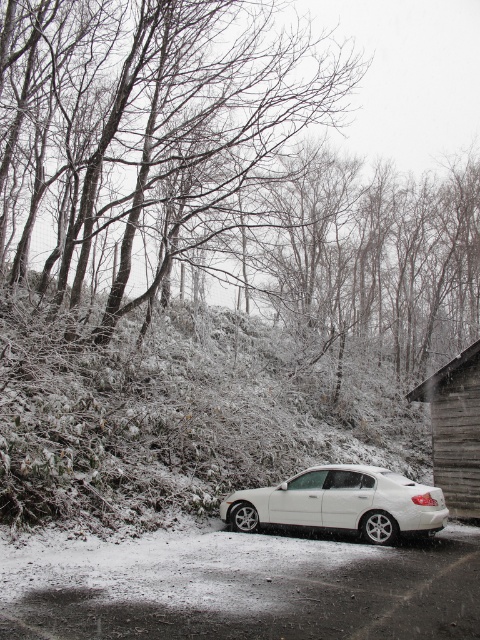
Question: Observing the image, what is the correct spatial positioning of snow-covered branches at upper left in reference to wooden cabin at right?

Choices:
 (A) right
 (B) left

Answer: (B)

Question: Estimate the real-world distances between objects in this image. Which object is farther from the snow-covered branches at upper left?

Choices:
 (A) wooden cabin at right
 (B) white matte sedan at center

Answer: (B)

Question: Which point appears farthest from the camera in this image?

Choices:
 (A) (356, 493)
 (B) (433, 429)
 (C) (192, 81)

Answer: (C)

Question: Does white matte sedan at center have a larger size compared to wooden cabin at right?

Choices:
 (A) yes
 (B) no

Answer: (B)

Question: Which point is closer to the camera?

Choices:
 (A) (464, 460)
 (B) (285, 518)
 (C) (57, 100)

Answer: (B)

Question: Does snow-covered branches at upper left have a greater width compared to wooden cabin at right?

Choices:
 (A) yes
 (B) no

Answer: (A)